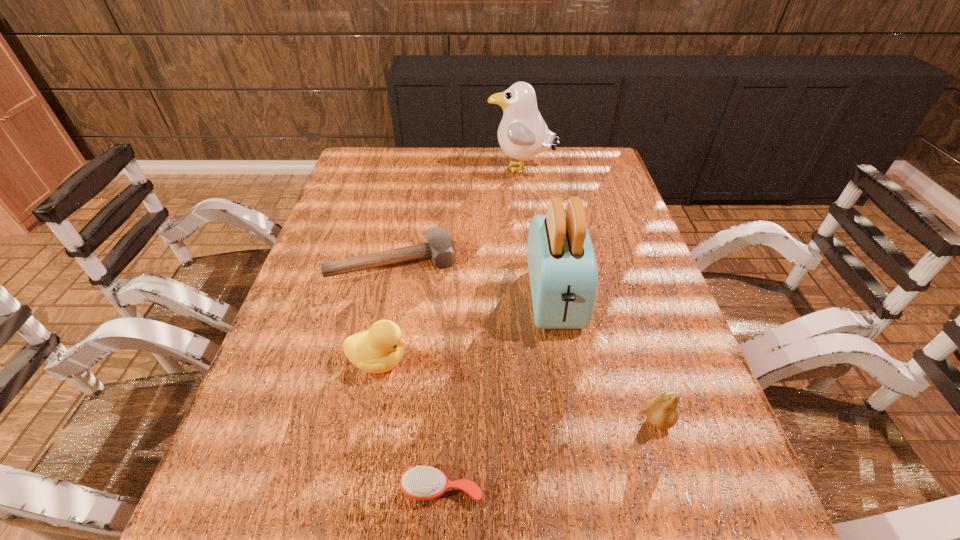
Find the location of a particular element. free space that satisfies the following two spatial constraints: 1. on the side of the toaster with the lever; 2. on the front-facing side of the third nearest object is located at coordinates (565, 361).

The width and height of the screenshot is (960, 540). Find the location of `blank space that satisfies the following two spatial constraints: 1. on the side of the rightmost object with the lever; 2. on the left side of the toaster`. blank space that satisfies the following two spatial constraints: 1. on the side of the rightmost object with the lever; 2. on the left side of the toaster is located at coordinates (575, 420).

The image size is (960, 540). Find the location of `free location that satisfies the following two spatial constraints: 1. on the front-facing side of the hairbrush; 2. on the left side of the third nearest object`. free location that satisfies the following two spatial constraints: 1. on the front-facing side of the hairbrush; 2. on the left side of the third nearest object is located at coordinates (353, 488).